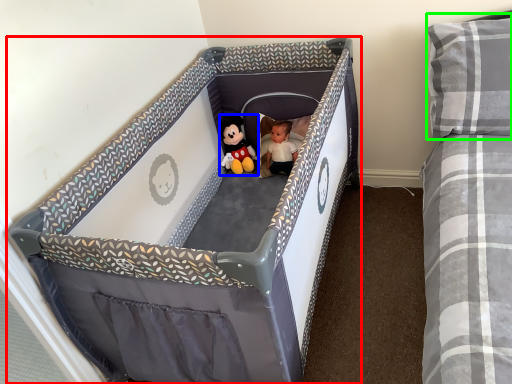
Question: Which object is positioned closest to infant bed (highlighted by a red box)? Select from toy (highlighted by a blue box) and pillow (highlighted by a green box).

Choices:
 (A) toy
 (B) pillow

Answer: (A)